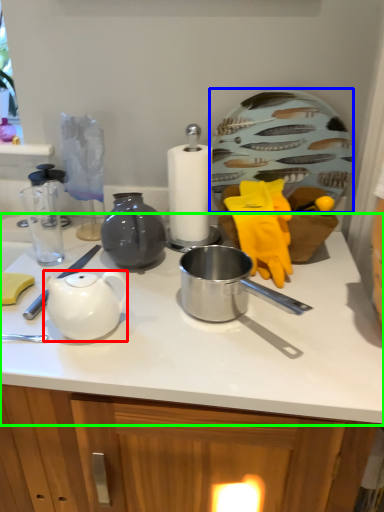
Question: Which object is the farthest from teapot (highlighted by a red box)? Choose among these: plate (highlighted by a blue box) or countertop (highlighted by a green box).

Choices:
 (A) plate
 (B) countertop

Answer: (A)